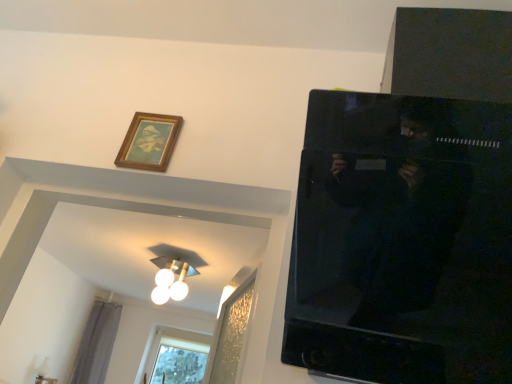
Question: Is white glossy light fixture at upper center completely or partially inside clear glass window at lower left?

Choices:
 (A) no
 (B) yes

Answer: (A)

Question: Does clear glass window at lower left have a lesser height compared to white glossy light fixture at upper center?

Choices:
 (A) no
 (B) yes

Answer: (A)

Question: Does clear glass window at lower left appear on the right side of white glossy light fixture at upper center?

Choices:
 (A) no
 (B) yes

Answer: (A)

Question: Is clear glass window at lower left facing towards white glossy light fixture at upper center?

Choices:
 (A) no
 (B) yes

Answer: (B)

Question: Would you consider clear glass window at lower left to be distant from white glossy light fixture at upper center?

Choices:
 (A) yes
 (B) no

Answer: (A)

Question: From the image's perspective, is clear glass window at lower left positioned above or below gray fabric curtain at lower left?

Choices:
 (A) above
 (B) below

Answer: (B)

Question: Based on their sizes in the image, would you say clear glass window at lower left is bigger or smaller than gray fabric curtain at lower left?

Choices:
 (A) big
 (B) small

Answer: (A)

Question: Is clear glass window at lower left in front of or behind gray fabric curtain at lower left in the image?

Choices:
 (A) behind
 (B) front

Answer: (A)

Question: From a real-world perspective, relative to gray fabric curtain at lower left, is clear glass window at lower left vertically above or below?

Choices:
 (A) below
 (B) above

Answer: (B)

Question: From a real-world perspective, is gray fabric curtain at lower left above or below white glossy light fixture at upper center?

Choices:
 (A) above
 (B) below

Answer: (B)

Question: From the image's perspective, is gray fabric curtain at lower left located above or below white glossy light fixture at upper center?

Choices:
 (A) above
 (B) below

Answer: (B)

Question: Choose the correct answer: Is gray fabric curtain at lower left inside white glossy light fixture at upper center or outside it?

Choices:
 (A) outside
 (B) inside

Answer: (A)

Question: Considering the positions of gray fabric curtain at lower left and white glossy light fixture at upper center in the image, is gray fabric curtain at lower left wider or thinner than white glossy light fixture at upper center?

Choices:
 (A) wide
 (B) thin

Answer: (B)

Question: Considering the relative positions of wooden picture frame at upper left and gray fabric curtain at lower left in the image provided, is wooden picture frame at upper left to the left or to the right of gray fabric curtain at lower left?

Choices:
 (A) right
 (B) left

Answer: (A)

Question: From the image's perspective, relative to gray fabric curtain at lower left, is wooden picture frame at upper left above or below?

Choices:
 (A) below
 (B) above

Answer: (B)